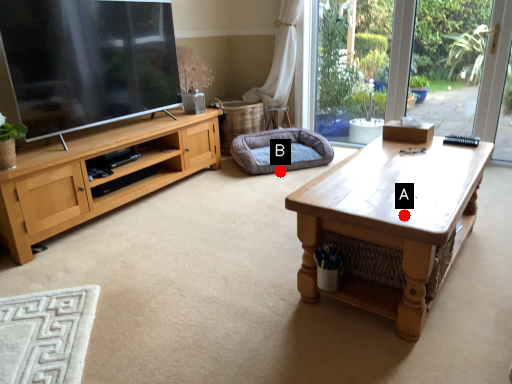
Question: Two points are circled on the image, labeled by A and B beside each circle. Which point is further to the camera?

Choices:
 (A) A is further
 (B) B is further

Answer: (B)